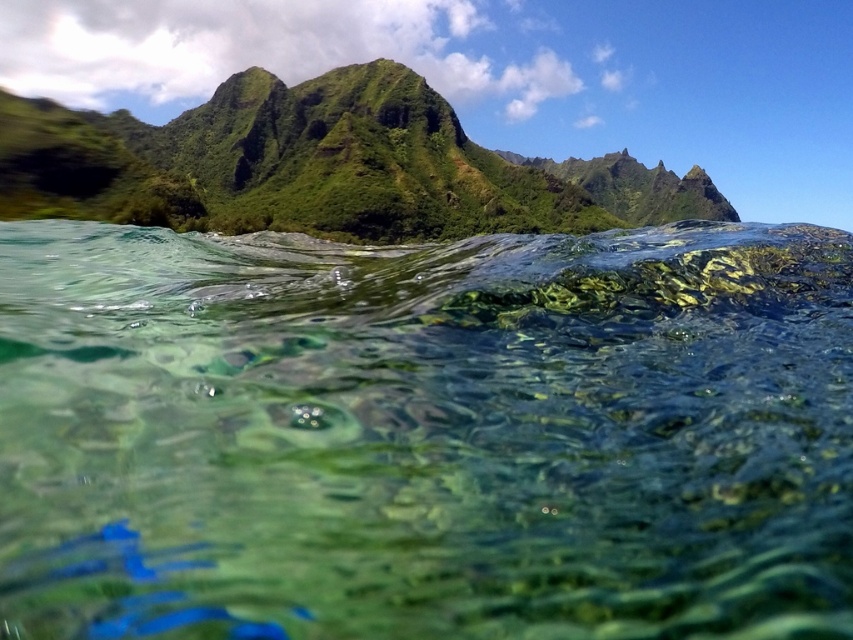
What are the coordinates of `clear glassy water at center` in the screenshot? It's located at (425, 433).

Is point (231, 317) closer to viewer compared to point (316, 138)?

Yes, it is.

Find the location of a particular element. The image size is (853, 640). clear glassy water at center is located at coordinates (425, 433).